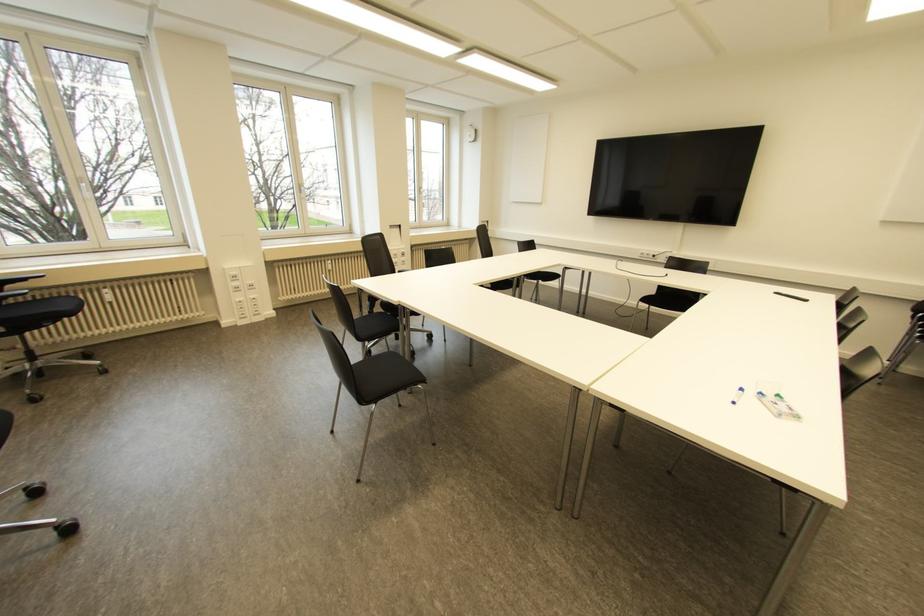
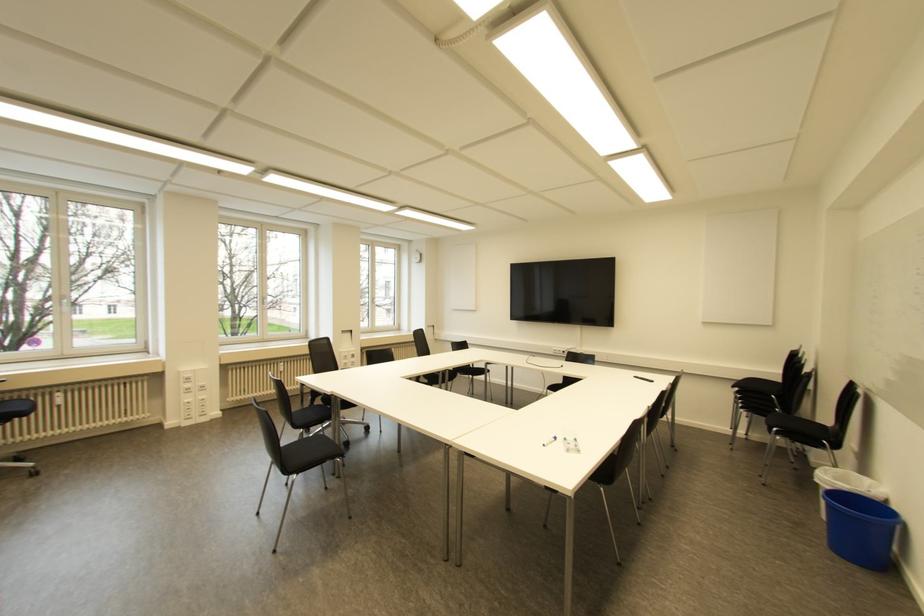
The point at (739, 390) is marked in the first image. Where is the corresponding point in the second image?

(554, 438)